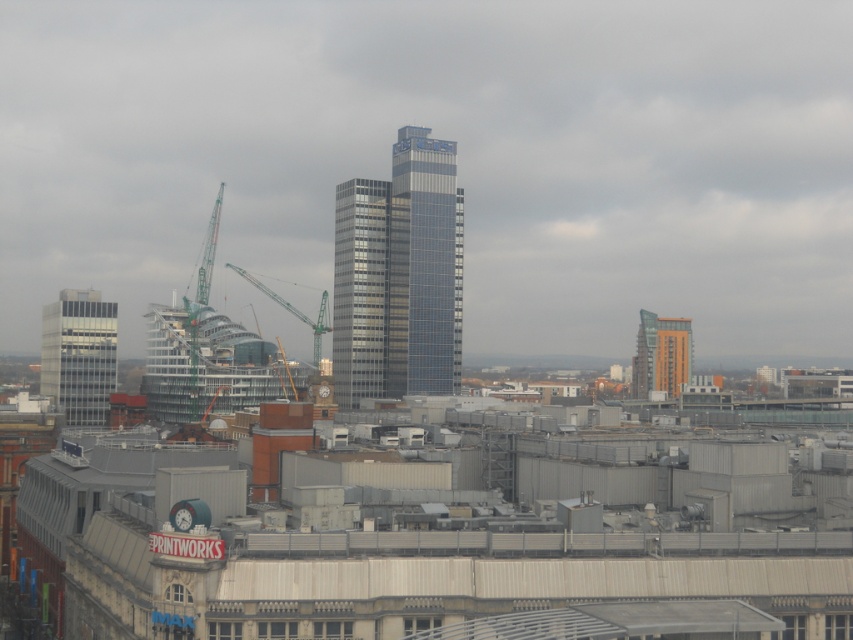
Between brown brick building at center and glassy steel tower at center, which one appears on the left side from the viewer's perspective?

From the viewer's perspective, glassy steel tower at center appears more on the left side.

Is point (625, 573) positioned in front of point (369, 356)?

Yes.

Where is `brown brick building at center`? This screenshot has width=853, height=640. brown brick building at center is located at coordinates (x=454, y=548).

Does point (51, 376) come farther from viewer compared to point (242, 276)?

That is False.

What do you see at coordinates (79, 355) in the screenshot? This screenshot has width=853, height=640. I see `matte glass building at left` at bounding box center [79, 355].

Measure the distance between point (96, 304) and camera.

They are 549.10 meters apart.

Where is `matte glass building at left`? Image resolution: width=853 pixels, height=640 pixels. matte glass building at left is located at coordinates (79, 355).

Which is below, glassy metallic skyscraper at center or orange glass building at right?

orange glass building at right is below.

Can you confirm if glassy metallic skyscraper at center is taller than orange glass building at right?

Yes, glassy metallic skyscraper at center is taller than orange glass building at right.

Between point (345, 342) and point (654, 336), which one is positioned in front?

Point (345, 342) is more forward.

Locate an element on the screen. The image size is (853, 640). glassy metallic skyscraper at center is located at coordinates (399, 275).